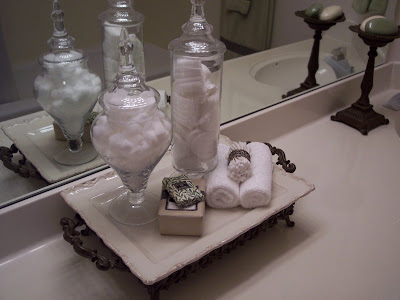
I want to click on grey countertop, so click(379, 198).